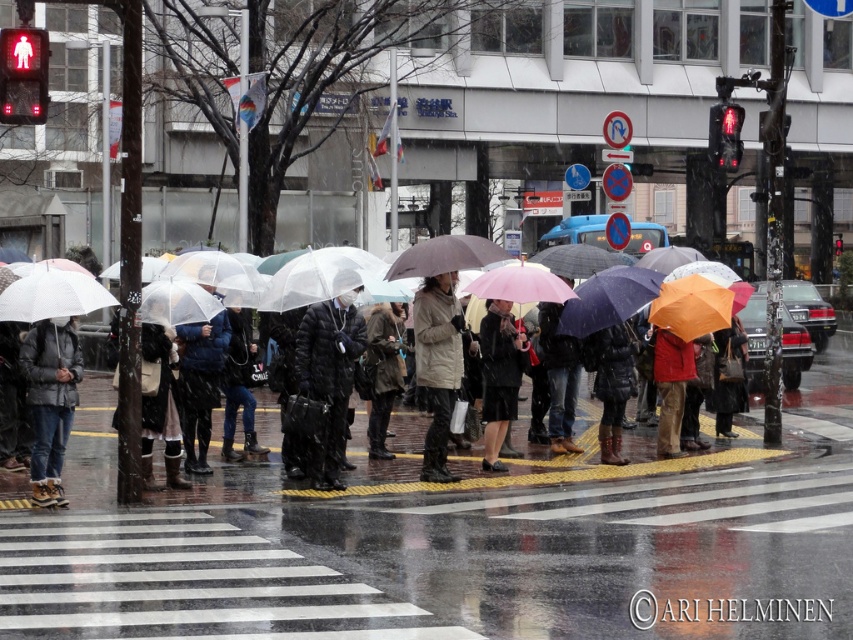
You are standing at the crosswalk and want to reach a bus stop located at point (383, 470). There is an obstacle at point (38, 449). Will you need to go around the obstacle to reach your destination?

Yes, because point (383, 470) is behind point (38, 449), so you must go around the obstacle at point (38, 449) to reach your destination.

You are standing at the crosswalk and need to reach a destination located at point (381, 416). There is an obstacle at point (680, 460) blocking your path. Which direction should you move to avoid the obstacle while heading towards your destination?

Since point (680, 460) is in front of point (381, 416), you should move sideways to avoid the obstacle while heading towards your destination.